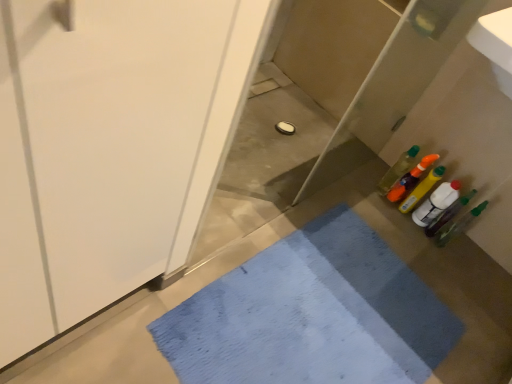
Question: Is translucent orange bottle at right, placed as the fifth bottle when sorted from right to left, spatially inside translucent plastic bottle at right, the third bottle in the right-to-left sequence, or outside of it?

Choices:
 (A) outside
 (B) inside

Answer: (A)

Question: Looking at their shapes, would you say translucent orange bottle at right, placed as the fifth bottle when sorted from right to left, is wider or thinner than translucent plastic bottle at right, the fourth bottle in the left-to-right sequence?

Choices:
 (A) thin
 (B) wide

Answer: (B)

Question: Which is nearer to the translucent plastic bottle at right, the third bottle from the left?

Choices:
 (A) translucent plastic bottle at right, the fourth bottle in the left-to-right sequence
 (B) translucent orange bottle at right, acting as the 2th bottle starting from the left
 (C) translucent plastic bottle at right, which ranks as the fifth bottle in left-to-right order
 (D) translucent plastic bottles at right, which is the sixth bottle from right to left
 (E) blue woven bath mat at lower center

Answer: (B)

Question: Which object is the closest to the translucent plastic bottle at right, the fourth bottle viewed from the right?

Choices:
 (A) blue woven bath mat at lower center
 (B) translucent plastic bottle at right, the second bottle when ordered from right to left
 (C) translucent plastic bottle at right, the third bottle in the right-to-left sequence
 (D) translucent orange bottle at right, acting as the 2th bottle starting from the left
 (E) translucent plastic bottle at right, the 1th bottle from the right

Answer: (D)